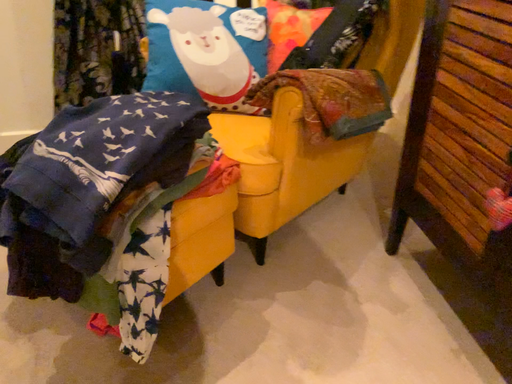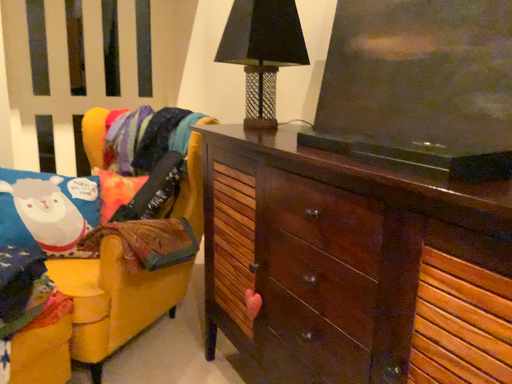
Question: How did the camera likely rotate when shooting the video?

Choices:
 (A) rotated downward
 (B) rotated upward

Answer: (B)